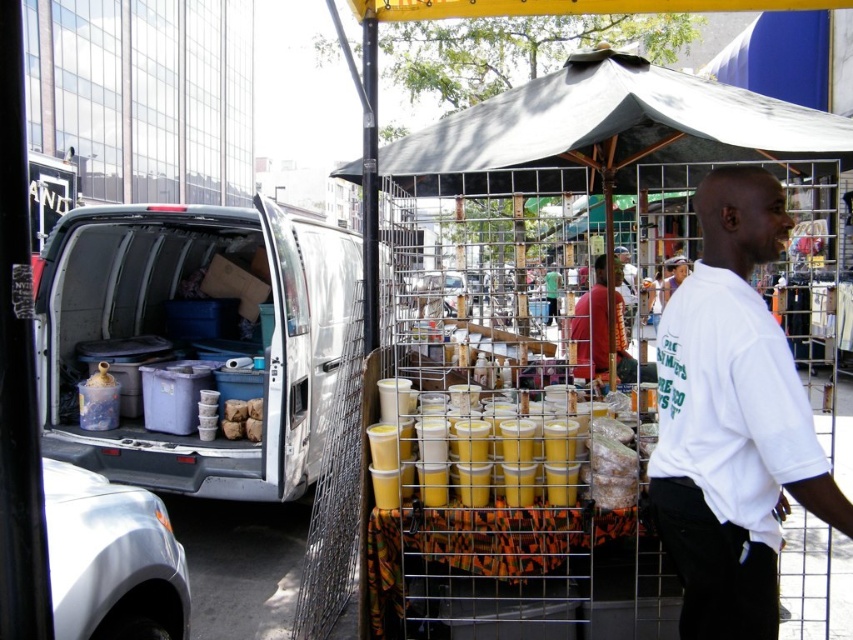
Does orange fabric shirt at center have a smaller size compared to white t-shirt at center?

Actually, orange fabric shirt at center might be larger than white t-shirt at center.

Is point (585, 378) closer to camera compared to point (662, 289)?

Yes, it is.

Which is in front, point (634, 369) or point (676, 268)?

Point (634, 369) is in front.

The width and height of the screenshot is (853, 640). In order to click on orange fabric shirt at center in this screenshot , I will do `click(592, 326)`.

Between white cotton t-shirt at center and white t-shirt at center, which one appears on the left side from the viewer's perspective?

From the viewer's perspective, white cotton t-shirt at center appears more on the left side.

Where is `white cotton t-shirt at center`? The width and height of the screenshot is (853, 640). white cotton t-shirt at center is located at coordinates (732, 420).

Is matte plastic containers at rear below orange fabric shirt at center?

Actually, matte plastic containers at rear is above orange fabric shirt at center.

Is the position of matte plastic containers at rear less distant than that of orange fabric shirt at center?

No, it is behind orange fabric shirt at center.

Is point (310, 348) positioned after point (583, 340)?

No, (310, 348) is closer to viewer.

Where is `matte plastic containers at rear`? The height and width of the screenshot is (640, 853). matte plastic containers at rear is located at coordinates (195, 340).